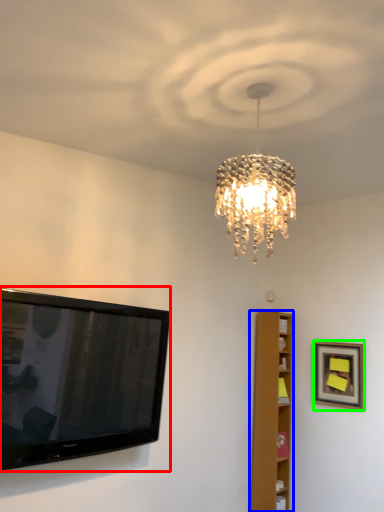
Question: Which is farther away from television (highlighted by a red box)? furniture (highlighted by a blue box) or picture frame (highlighted by a green box)?

Choices:
 (A) furniture
 (B) picture frame

Answer: (B)